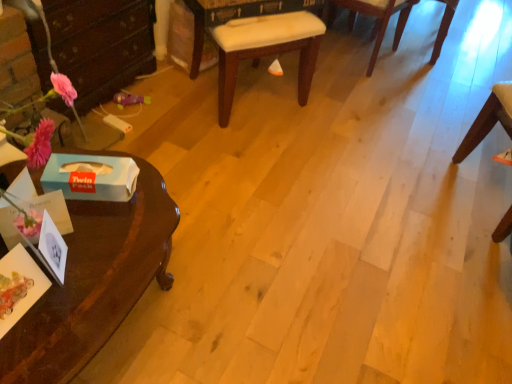
Question: Based on their sizes in the image, would you say white fabric cushion at center, which ranks as the 3th chair in right-to-left order, is bigger or smaller than glossy dark wood desk at left?

Choices:
 (A) big
 (B) small

Answer: (A)

Question: Is point (302, 89) closer or farther from the camera than point (66, 370)?

Choices:
 (A) farther
 (B) closer

Answer: (A)

Question: Considering the real-world distances, which object is farthest from the white cardboard box at lower left, the 2th box when ordered from front to back?

Choices:
 (A) blue paper tissue box at left, the second box in the back-to-front sequence
 (B) glossy dark wood desk at left
 (C) wooden chair at upper right, the third chair in the left-to-right sequence
 (D) white fabric cushion at center, which ranks as the 3th chair in right-to-left order
 (E) wooden chair at right, arranged as the second chair when viewed from the left

Answer: (C)

Question: Which of these objects is positioned closest to the wooden chair at upper right, which ranks as the first chair in right-to-left order?

Choices:
 (A) glossy dark wood desk at left
 (B) wooden chair at right, acting as the second chair starting from the right
 (C) white cardboard box at lower left, the 2th box when ordered from front to back
 (D) blue paper tissue box at left, the second box in the back-to-front sequence
 (E) white fabric cushion at center, positioned as the first chair in left-to-right order

Answer: (B)